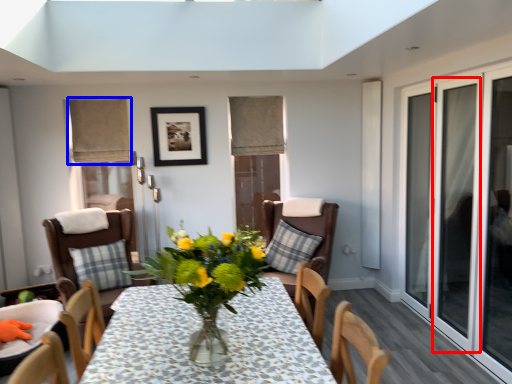
Question: Which object is closer to the camera taking this photo, screen door (highlighted by a red box) or curtain (highlighted by a blue box)?

Choices:
 (A) screen door
 (B) curtain

Answer: (A)